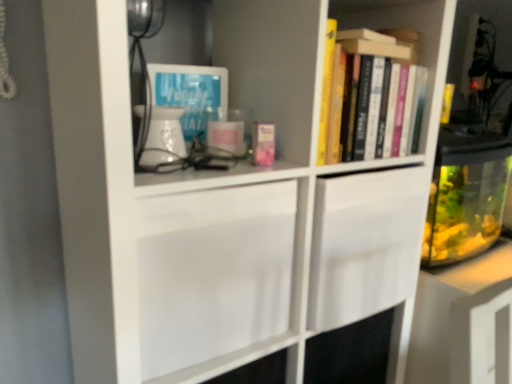
Question: Does transparent glass fish tank at right come behind hardcover books at upper right, marked as the 2th book in a left-to-right arrangement?

Choices:
 (A) yes
 (B) no

Answer: (A)

Question: Is transparent glass fish tank at right facing away from hardcover books at upper right, the first book positioned from the right?

Choices:
 (A) no
 (B) yes

Answer: (A)

Question: Is transparent glass fish tank at right positioned far away from hardcover books at upper right, marked as the 2th book in a left-to-right arrangement?

Choices:
 (A) yes
 (B) no

Answer: (B)

Question: Does transparent glass fish tank at right turn towards hardcover books at upper right, the first book in the back-to-front sequence?

Choices:
 (A) yes
 (B) no

Answer: (B)

Question: Are transparent glass fish tank at right and hardcover books at upper right, which appears as the 2th book when viewed from the front, beside each other?

Choices:
 (A) no
 (B) yes

Answer: (A)

Question: Relative to blue paper at upper left, is hardcover books at upper right, which appears as the 2th book when viewed from the front, in front or behind?

Choices:
 (A) front
 (B) behind

Answer: (A)

Question: Would you say hardcover books at upper right, the first book in the back-to-front sequence, is inside or outside blue paper at upper left?

Choices:
 (A) outside
 (B) inside

Answer: (A)

Question: From a real-world perspective, is hardcover books at upper right, marked as the 2th book in a left-to-right arrangement, positioned above or below blue paper at upper left?

Choices:
 (A) below
 (B) above

Answer: (B)

Question: Does point (332, 142) appear closer or farther from the camera than point (177, 84)?

Choices:
 (A) closer
 (B) farther

Answer: (A)

Question: In the image, is blue paper at upper left on the left side or the right side of pink matte book at center, the 2th book in the right-to-left sequence?

Choices:
 (A) right
 (B) left

Answer: (B)

Question: Is blue paper at upper left taller or shorter than pink matte book at center, the first book viewed from the front?

Choices:
 (A) tall
 (B) short

Answer: (A)

Question: In the image, is blue paper at upper left positioned in front of or behind pink matte book at center, the 2th book in the right-to-left sequence?

Choices:
 (A) behind
 (B) front

Answer: (A)

Question: Considering the positions of blue paper at upper left and pink matte book at center, the 2th book in the right-to-left sequence, in the image, is blue paper at upper left wider or thinner than pink matte book at center, the 2th book in the right-to-left sequence,?

Choices:
 (A) wide
 (B) thin

Answer: (A)

Question: In terms of width, does transparent glass fish tank at right look wider or thinner when compared to blue paper at upper left?

Choices:
 (A) wide
 (B) thin

Answer: (A)

Question: Based on their positions, is transparent glass fish tank at right located to the left or right of blue paper at upper left?

Choices:
 (A) right
 (B) left

Answer: (A)